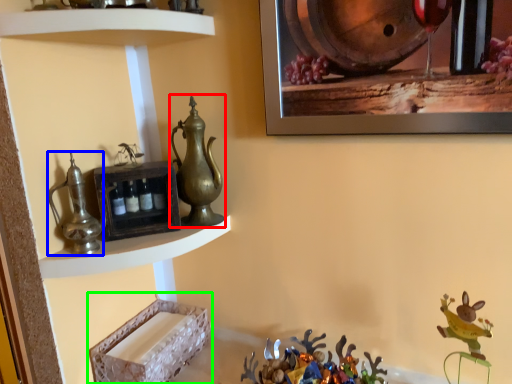
Question: Which is nearer to the jug (highlighted by a red box)? jug (highlighted by a blue box) or shelf (highlighted by a green box).

Choices:
 (A) jug
 (B) shelf

Answer: (A)